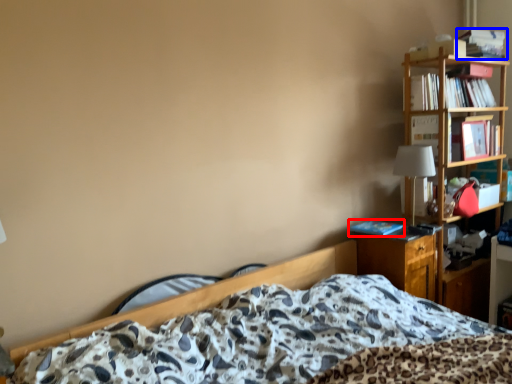
Question: Which object is closer to the camera taking this photo, book (highlighted by a red box) or book (highlighted by a blue box)?

Choices:
 (A) book
 (B) book

Answer: (A)